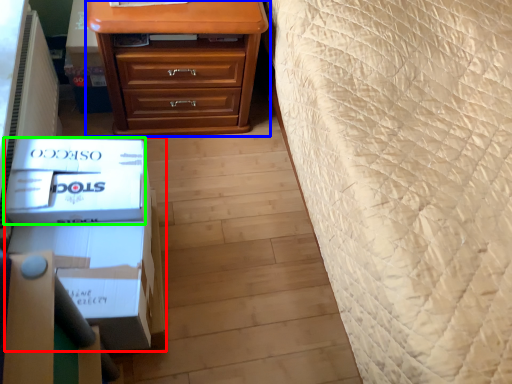
Question: Considering the real-world distances, which object is farthest from box (highlighted by a red box)? chest of drawers (highlighted by a blue box) or box (highlighted by a green box)?

Choices:
 (A) chest of drawers
 (B) box

Answer: (A)